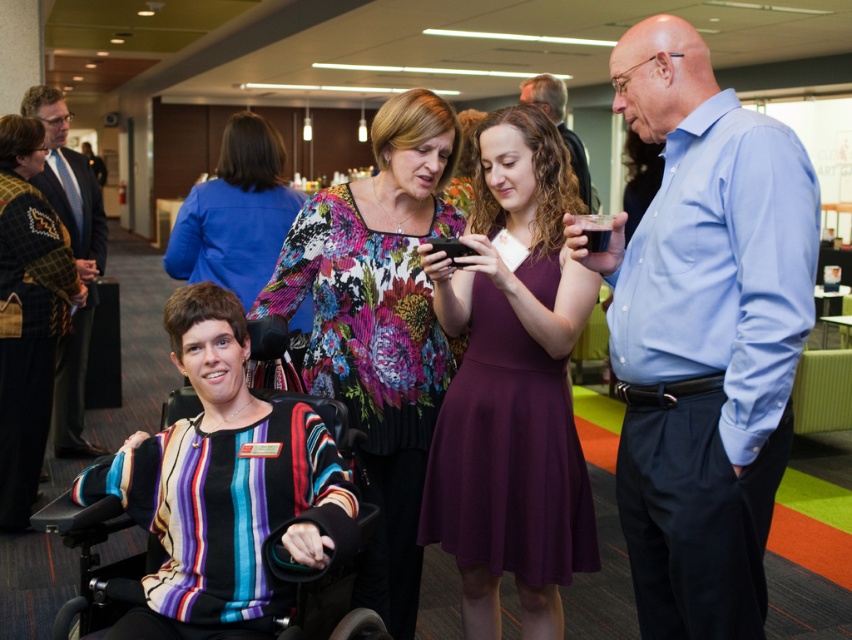
Who is higher up, floral-patterned blouse at center or black plastic wheelchair at left?

Positioned higher is floral-patterned blouse at center.

Can you confirm if floral-patterned blouse at center is taller than black plastic wheelchair at left?

Indeed, floral-patterned blouse at center has a greater height compared to black plastic wheelchair at left.

Which is behind, point (355, 305) or point (279, 392)?

The point (355, 305) is behind.

Image resolution: width=852 pixels, height=640 pixels. I want to click on floral-patterned blouse at center, so click(x=378, y=324).

Who is positioned more to the left, black plastic wheelchair at left or dark blue suit at left?

From the viewer's perspective, dark blue suit at left appears more on the left side.

The image size is (852, 640). Identify the location of black plastic wheelchair at left. (323, 579).

Is black plastic wheelchair at left below black matte smartphone at center?

Yes, black plastic wheelchair at left is below black matte smartphone at center.

Does point (331, 428) lie in front of point (445, 253)?

No, it is not.

The width and height of the screenshot is (852, 640). What do you see at coordinates (323, 579) in the screenshot?
I see `black plastic wheelchair at left` at bounding box center [323, 579].

Where is `black plastic wheelchair at left`? The image size is (852, 640). black plastic wheelchair at left is located at coordinates (323, 579).